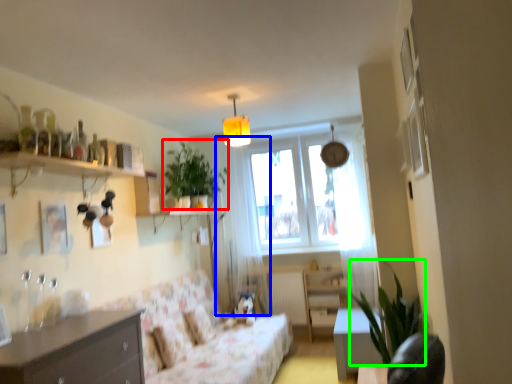
Question: Which is farther away from plant (highlighted by a red box)? curtain (highlighted by a blue box) or plant (highlighted by a green box)?

Choices:
 (A) curtain
 (B) plant

Answer: (B)